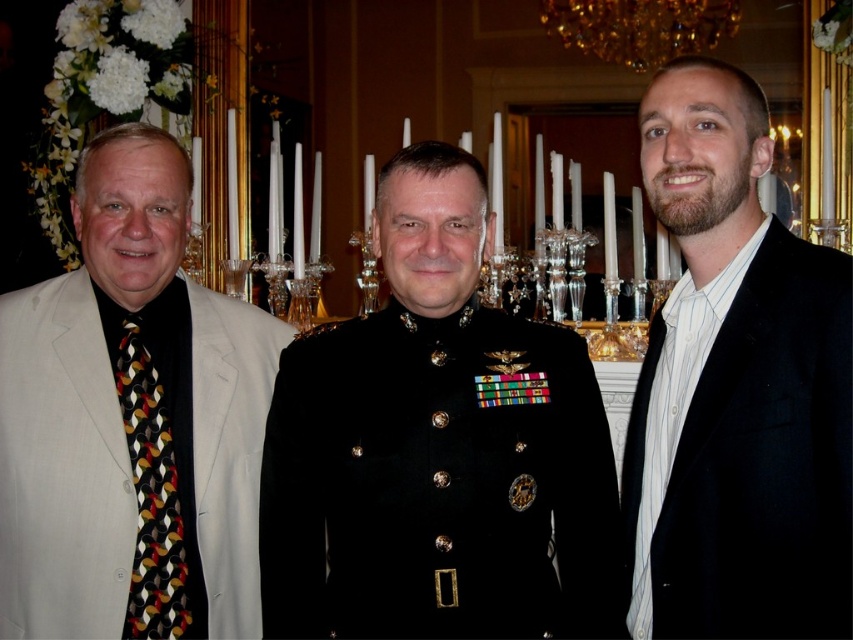
Does point (505, 548) come behind point (144, 387)?

No, it is in front of (144, 387).

Can you confirm if black uniform at center is positioned above multicolored patterned tie at left?

Yes, black uniform at center is above multicolored patterned tie at left.

Is point (544, 384) closer to viewer compared to point (180, 490)?

Yes.

Find the location of a particular element. The height and width of the screenshot is (640, 853). black uniform at center is located at coordinates [437, 449].

Which of these two, black velvet suit at right or multicolored patterned tie at left, stands taller?

With more height is black velvet suit at right.

Is point (813, 342) closer to camera compared to point (175, 593)?

Yes, it is in front of point (175, 593).

I want to click on black velvet suit at right, so click(x=735, y=388).

Does black uniform at center appear over light beige suit at left?

Actually, black uniform at center is below light beige suit at left.

Is black uniform at center shorter than light beige suit at left?

Indeed, black uniform at center has a lesser height compared to light beige suit at left.

Is point (387, 390) closer to camera compared to point (3, 404)?

That is True.

In order to click on black uniform at center in this screenshot , I will do `click(437, 449)`.